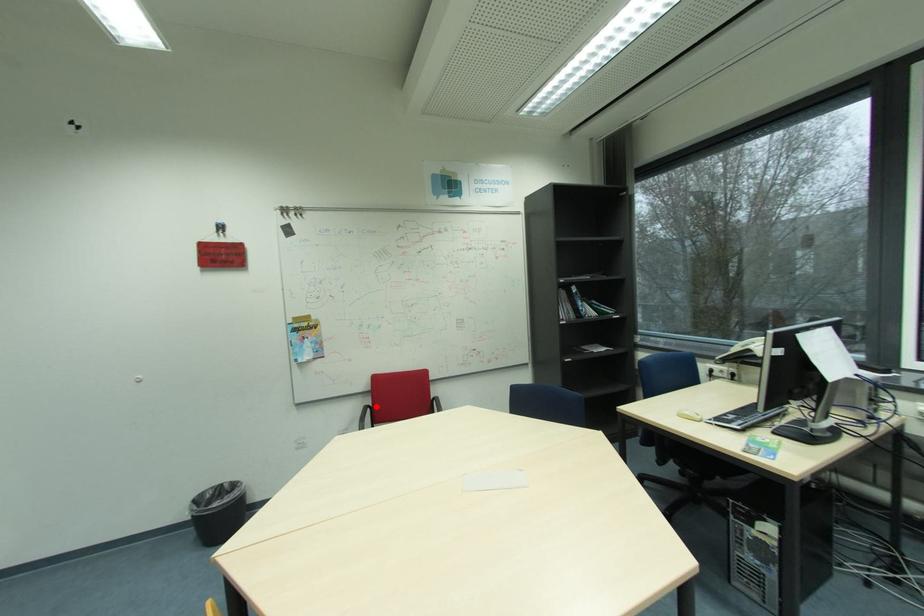
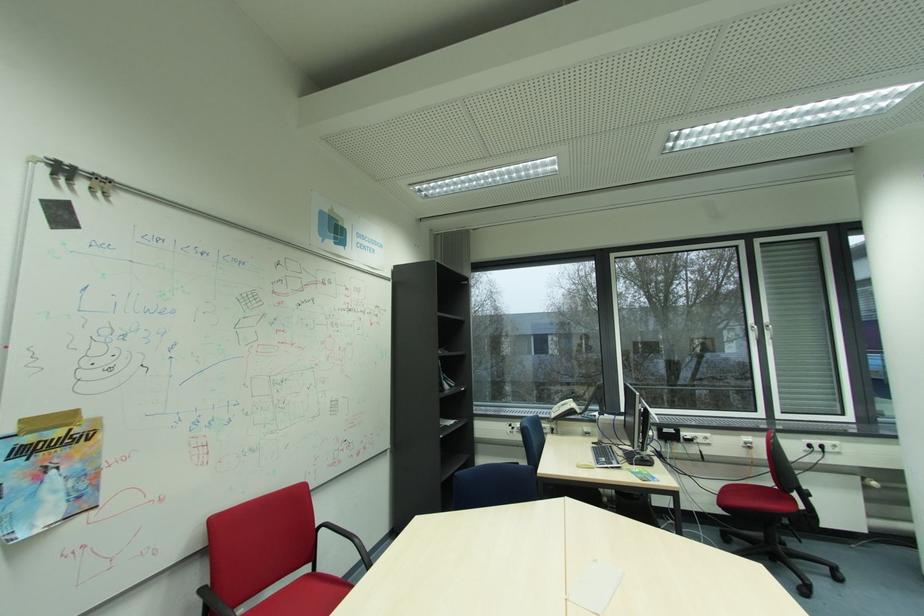
In the second image, find the point that corresponds to the highlighted location in the first image.

(212, 589)